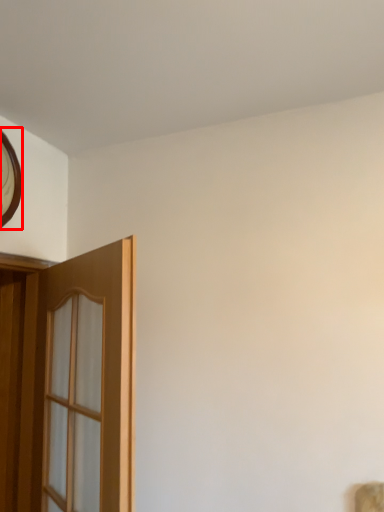
Question: Where is clock (annotated by the red box) located in relation to door in the image?

Choices:
 (A) left
 (B) right

Answer: (A)